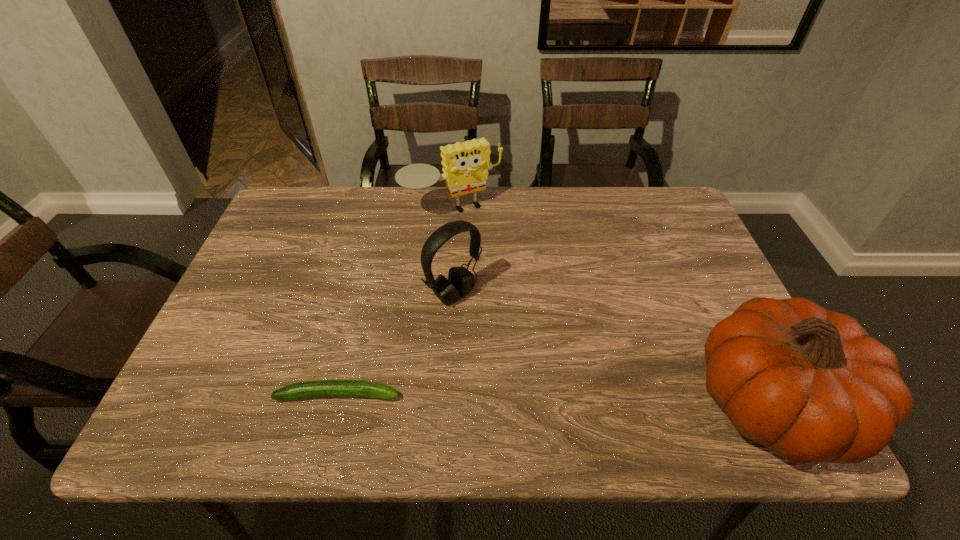
Locate an element on the screen. empty space between the second farthest object and the sponge is located at coordinates (453, 253).

I want to click on free space between the pumpkin and the headset, so click(612, 349).

The width and height of the screenshot is (960, 540). In order to click on free space that is in between the zucchini and the sponge in this screenshot , I will do `click(396, 303)`.

Identify the location of object that is the nearest to the zucchini. The height and width of the screenshot is (540, 960). (460, 282).

The image size is (960, 540). I want to click on the third closest object relative to the rightmost object, so click(x=326, y=388).

This screenshot has height=540, width=960. In order to click on vacant point that satisfies the following two spatial constraints: 1. on the front side of the second farthest object; 2. on the face of the pumpkin in this screenshot , I will do `click(448, 403)`.

Where is `blank space that satisfies the following two spatial constraints: 1. on the front side of the sponge; 2. on the face of the rightmost object`? Image resolution: width=960 pixels, height=540 pixels. blank space that satisfies the following two spatial constraints: 1. on the front side of the sponge; 2. on the face of the rightmost object is located at coordinates (439, 403).

Find the location of a particular element. Image resolution: width=960 pixels, height=540 pixels. free region that satisfies the following two spatial constraints: 1. on the front side of the pumpkin; 2. on the face of the sponge is located at coordinates (439, 403).

Image resolution: width=960 pixels, height=540 pixels. In order to click on free location that satisfies the following two spatial constraints: 1. on the front side of the pumpkin; 2. on the face of the third nearest object in this screenshot , I will do `click(448, 403)`.